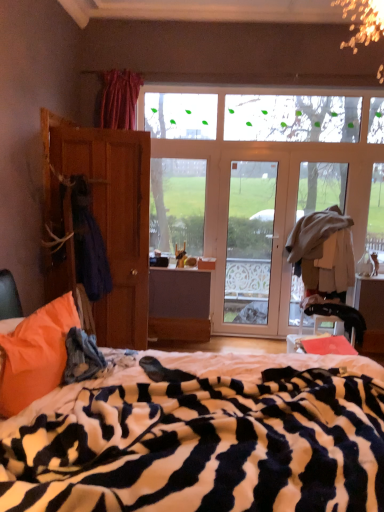
The height and width of the screenshot is (512, 384). Identify the location of vacant region above clear glass door at center (from a real-world perspective). (260, 148).